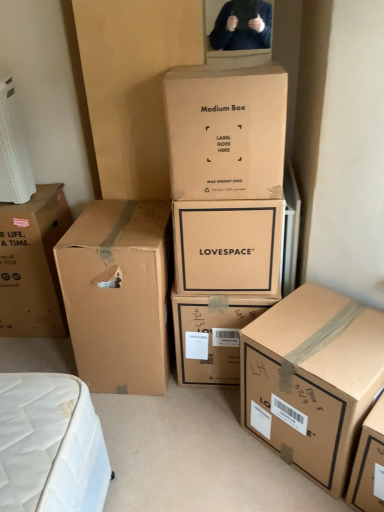
Question: Should I look upward or downward to see brown cardboard box at lower right, the 1th box from the right?

Choices:
 (A) up
 (B) down

Answer: (B)

Question: Which direction should I rotate to look at matte cardboard box at center, the 4th box viewed from the left?

Choices:
 (A) left
 (B) right

Answer: (B)

Question: Considering the relative sizes of brown cardboard box at left, which is the first box from left to right, and brown cardboard box at lower right, the 1th box from the right, in the image provided, is brown cardboard box at left, which is the first box from left to right, shorter than brown cardboard box at lower right, the 1th box from the right,?

Choices:
 (A) yes
 (B) no

Answer: (B)

Question: From a real-world perspective, is brown cardboard box at left, the sixth box viewed from the right, physically above brown cardboard box at lower right, the 1th box from the right?

Choices:
 (A) no
 (B) yes

Answer: (B)

Question: Can we say brown cardboard box at left, which is the first box from left to right, lies outside brown cardboard box at lower right, the 1th box from the right?

Choices:
 (A) yes
 (B) no

Answer: (A)

Question: Can you confirm if brown cardboard box at left, the sixth box viewed from the right, is taller than brown cardboard box at lower right, the 1th box from the right?

Choices:
 (A) yes
 (B) no

Answer: (A)

Question: Does brown cardboard box at left, the sixth box viewed from the right, touch brown cardboard box at lower right, the 6th box from the left?

Choices:
 (A) no
 (B) yes

Answer: (A)

Question: Is brown cardboard box at left, the sixth box viewed from the right, in front of brown cardboard box at lower right, the 1th box from the right?

Choices:
 (A) no
 (B) yes

Answer: (A)

Question: Is matte brown box at center, the second box positioned from the right, positioned in front of brown cardboard box at center, the third box in the left-to-right sequence?

Choices:
 (A) yes
 (B) no

Answer: (B)

Question: Is matte brown box at center, which is the 5th box in left-to-right order, outside of brown cardboard box at center, the 4th box in the right-to-left sequence?

Choices:
 (A) no
 (B) yes

Answer: (B)

Question: From a real-world perspective, is matte brown box at center, the second box positioned from the right, located higher than brown cardboard box at center, the third box in the left-to-right sequence?

Choices:
 (A) no
 (B) yes

Answer: (A)

Question: From the image's perspective, is matte brown box at center, which is the 5th box in left-to-right order, located above brown cardboard box at center, the 4th box in the right-to-left sequence?

Choices:
 (A) yes
 (B) no

Answer: (B)

Question: Can brown cardboard box at center, the 4th box in the right-to-left sequence, be found inside matte brown box at center, which is the 5th box in left-to-right order?

Choices:
 (A) no
 (B) yes

Answer: (A)

Question: Does matte brown box at center, which is the 5th box in left-to-right order, touch brown cardboard box at center, the 4th box in the right-to-left sequence?

Choices:
 (A) yes
 (B) no

Answer: (B)

Question: Is matte cardboard box at center, positioned as the third box in right-to-left order, turned away from brown cardboard box at lower right, the 1th box from the right?

Choices:
 (A) no
 (B) yes

Answer: (A)